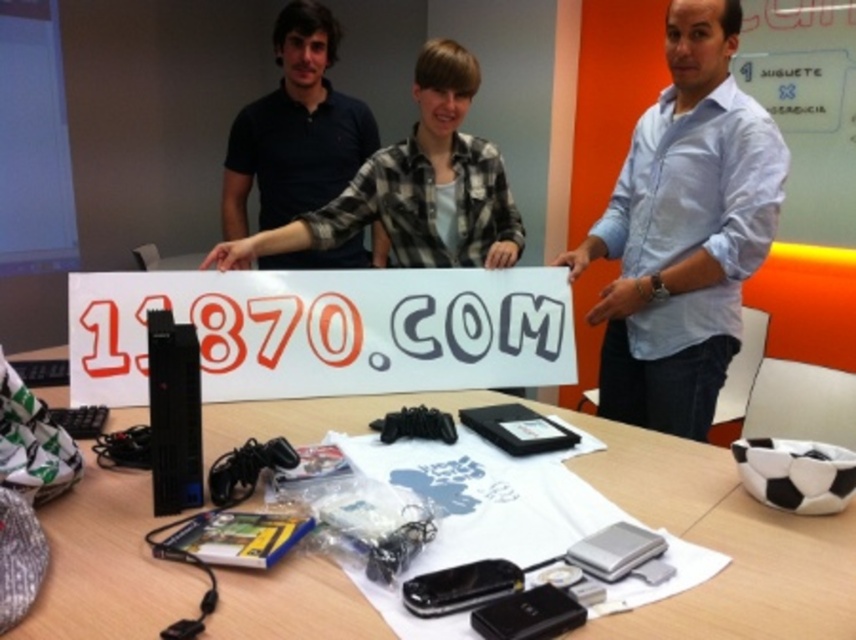
Does light blue shirt at center appear on the right side of plaid shirt at center?

Yes, light blue shirt at center is to the right of plaid shirt at center.

Identify the location of light blue shirt at center. (684, 230).

Image resolution: width=856 pixels, height=640 pixels. I want to click on light blue shirt at center, so click(x=684, y=230).

Between plaid shirt at center and dark blue polo shirt at upper left, which one appears on the left side from the viewer's perspective?

dark blue polo shirt at upper left

Who is shorter, plaid shirt at center or dark blue polo shirt at upper left?

With less height is plaid shirt at center.

Is point (450, 260) positioned before point (319, 163)?

Yes, point (450, 260) is in front of point (319, 163).

Where is `plaid shirt at center`? This screenshot has width=856, height=640. plaid shirt at center is located at coordinates (415, 186).

Can you confirm if wooden table at center is thinner than white paper sign at center?

No, wooden table at center is not thinner than white paper sign at center.

Is point (45, 394) positioned after point (73, 317)?

Yes, it is.

At what (x,y) coordinates should I click in order to perform the action: click on wooden table at center. Please return your answer as a coordinate pair (x, y). Looking at the image, I should click on (721, 541).